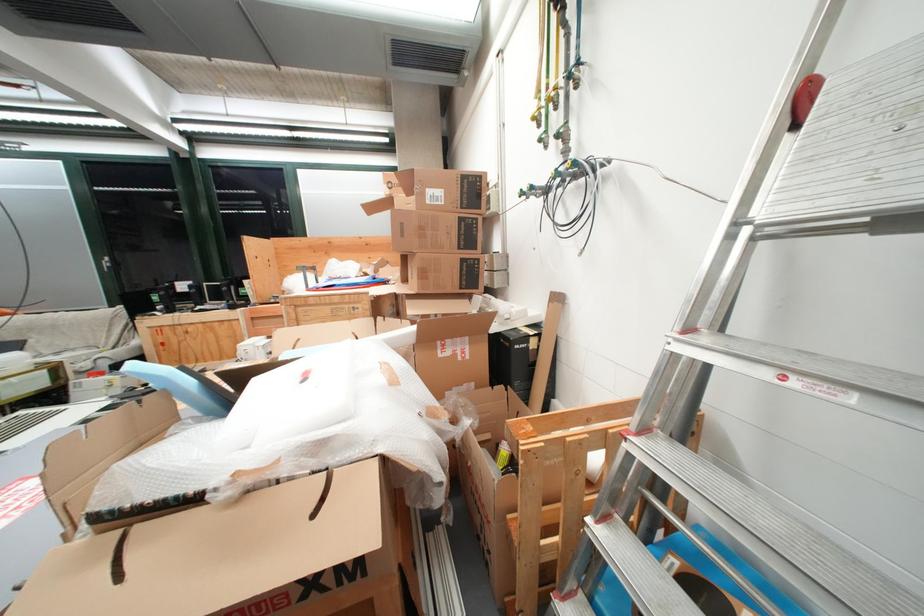
This screenshot has width=924, height=616. Identify the location of green valve dial. (598, 78).